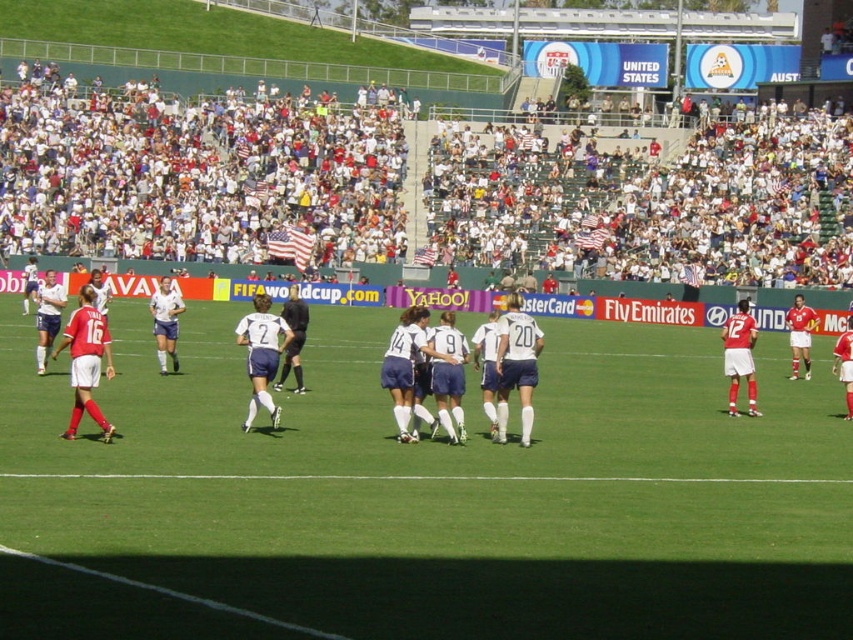
You are a photographer standing at the edge of the soccer field. You want to take a photo that includes both the white fabric crowd at upper center and the white jersey at center. Which object should you focus on first to ensure both are in the frame?

You should focus on the white fabric crowd at upper center first because it is closer to you than the white jersey at center, ensuring both are in the frame.

You are a photographer standing at the point marked by coordinates (195, 172). Looking around, you see the white fabric crowd at upper center. What is the direction of the white fabric crowd relative to your position?

The white fabric crowd at upper center is located at the point indicated by the coordinates (195, 172), which means it is directly in front of you.

You are standing at the point labeled as point (846, 246) in the image. You want to walk to the nearest exit of the stadium, which is located at the far end of the field. Which direction should you head towards to reach the exit?

The point labeled as point (846, 246) is 49.56 meters away from the viewer. To reach the nearest exit located at the far end of the field, you should head in the direction away from the current position towards the opposite end of the field.